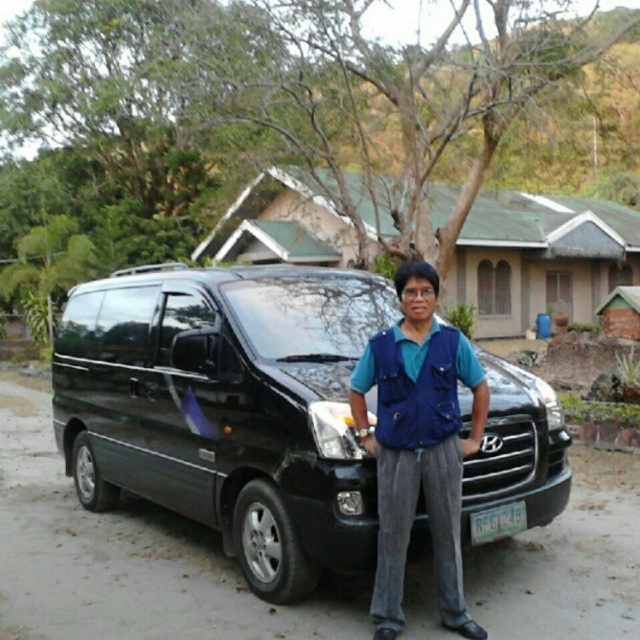
Question: Based on their relative distances, which object is farther from the white plastic license plate at center?

Choices:
 (A) black matte van at center
 (B) blue fabric vest at center

Answer: (B)

Question: Is black matte van at center below white plastic license plate at center?

Choices:
 (A) yes
 (B) no

Answer: (B)

Question: Is blue fabric vest at center above white plastic license plate at center?

Choices:
 (A) yes
 (B) no

Answer: (A)

Question: Which point is farther from the camera taking this photo?

Choices:
 (A) (513, 508)
 (B) (500, 500)

Answer: (A)

Question: Does blue fabric vest at center have a lesser width compared to white plastic license plate at center?

Choices:
 (A) yes
 (B) no

Answer: (B)

Question: Which object is closer to the camera taking this photo?

Choices:
 (A) black matte van at center
 (B) blue fabric vest at center
 (C) white plastic license plate at center

Answer: (B)